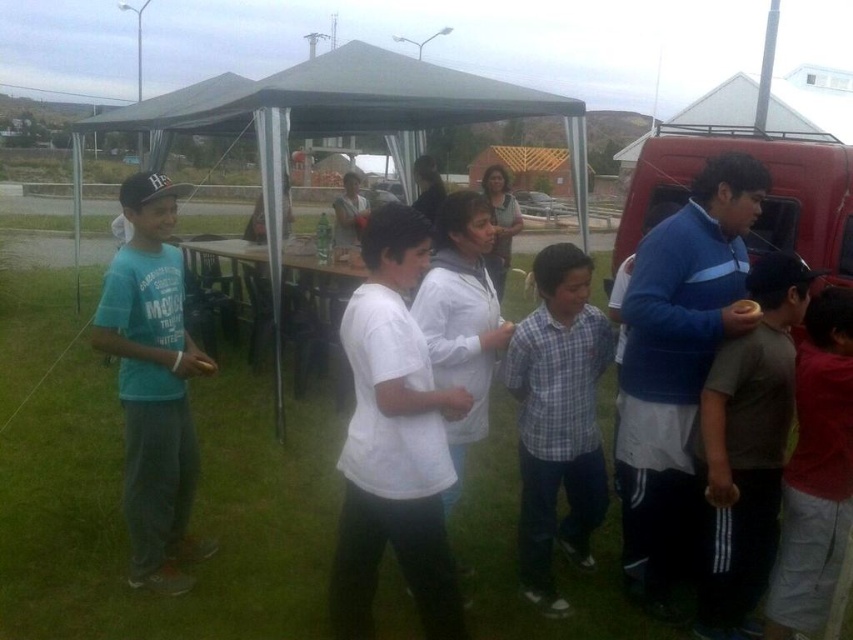
Question: Estimate the real-world distances between objects in this image. Which object is farther from the teal t-shirt at left?

Choices:
 (A) brown cotton shirt at right
 (B) red shirt at center
 (C) plaid cotton shirt at center
 (D) white matte shirt at center

Answer: (B)

Question: Which object appears farthest from the camera in this image?

Choices:
 (A) teal t-shirt at left
 (B) white matte shirt at center
 (C) green fabric tent at center
 (D) plaid cotton shirt at center

Answer: (C)

Question: Which of the following is the farthest from the observer?

Choices:
 (A) coord(839,340)
 (B) coord(567,356)
 (C) coord(331,586)

Answer: (B)

Question: Can you confirm if white matte shirt at center is positioned above plaid cotton shirt at center?

Choices:
 (A) yes
 (B) no

Answer: (B)

Question: Can you confirm if white matte shirt at center is positioned to the right of plaid cotton shirt at center?

Choices:
 (A) yes
 (B) no

Answer: (B)

Question: Is white matte shirt at center smaller than teal t-shirt at left?

Choices:
 (A) yes
 (B) no

Answer: (B)